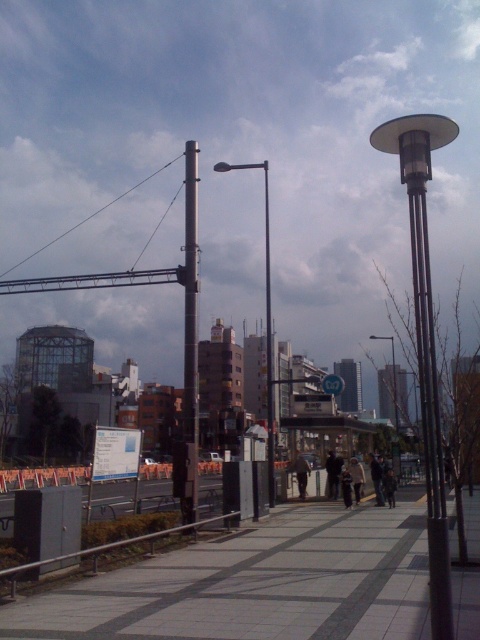
Question: Does gray concrete pavement at center appear on the right side of metallic gray pole at center?

Choices:
 (A) no
 (B) yes

Answer: (B)

Question: Which of the following is the farthest from the observer?

Choices:
 (A) (330, 385)
 (B) (377, 492)
 (C) (379, 336)

Answer: (C)

Question: Does metallic pole at center appear under green plastic sign at center?

Choices:
 (A) yes
 (B) no

Answer: (B)

Question: Which point is farther to the camera?

Choices:
 (A) dark gray fabric jacket at center
 (B) dark brown leather jacket at center
 (C) metallic pole at center
 (D) metallic gray pole at right

Answer: (B)

Question: Can you confirm if metallic gray pole at center is thinner than metallic pole at center?

Choices:
 (A) yes
 (B) no

Answer: (B)

Question: Which of the following is the closest to the observer?

Choices:
 (A) (357, 472)
 (B) (391, 346)
 (C) (269, 467)
 (D) (379, 484)

Answer: (C)